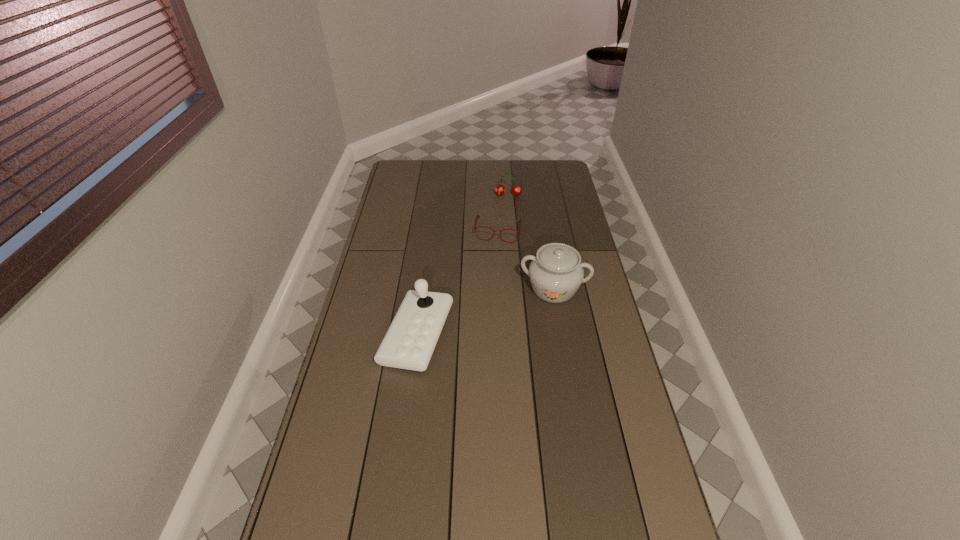
This screenshot has width=960, height=540. I want to click on joystick, so click(409, 343).

The width and height of the screenshot is (960, 540). Identify the location of chinaware. (556, 272).

Locate an element on the screen. the third tallest object is located at coordinates (516, 190).

This screenshot has height=540, width=960. Identify the location of cherry. (516, 190).

Identify the location of the shortest object. (475, 228).

This screenshot has width=960, height=540. Identify the location of spectacles. pyautogui.click(x=475, y=228).

Locate an element on the screen. The image size is (960, 540). vacant point located 0.070m on the left of the joystick is located at coordinates (362, 335).

I want to click on vacant space located 0.080m on the back of the chinaware, so click(548, 258).

This screenshot has height=540, width=960. In order to click on vacant space located 0.180m with stems pointing upwards on the farthest object in this screenshot , I will do `click(507, 220)`.

I want to click on vacant space positioned 0.140m with stems pointing upwards on the farthest object, so click(x=507, y=215).